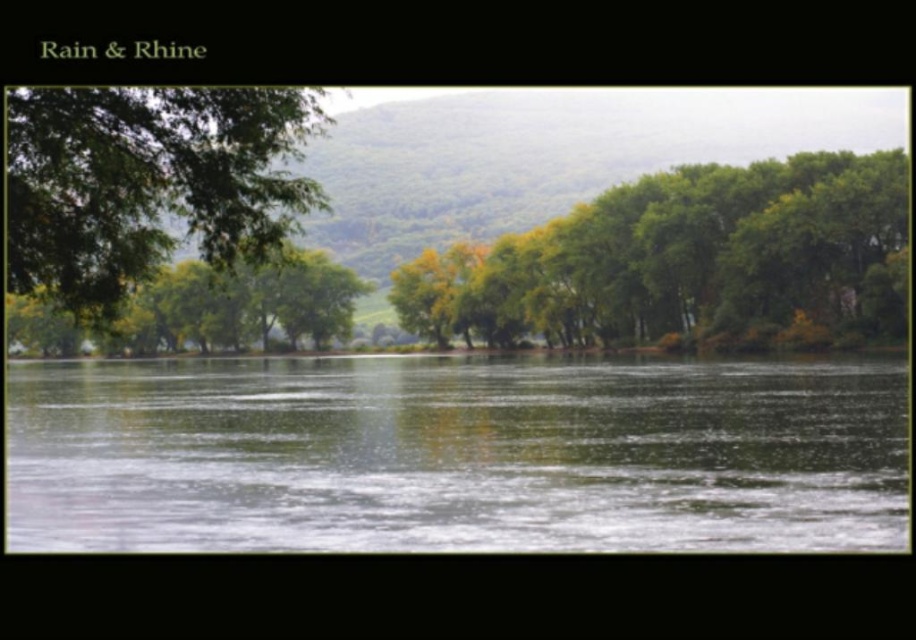
You are standing at the riverside and want to cross the river using a small wooden bridge. The bridge you have can only support objects up to the width of the green leafy tree at left. Will the bridge be wide enough to cross the green reflective water at center?

The green reflective water at center might be wider than green leafy tree at left, so the bridge may not be wide enough to cross the water safely.

You are standing on the riverside and see the green leafy trees at center and the green leafy tree at left. Which one is positioned more to the right side of the scene?

The green leafy trees at center is positioned more to the right side of the scene compared to the green leafy tree at left.

You are a hiker who wants to cross the river using a small boat. The boat can carry you and your gear but requires at least 2 meters of clearance between the green reflective water at center and the green leafy trees at center to avoid getting stuck. Is the distance sufficient?

The distance between the green reflective water at center and the green leafy trees at center is 27.46 meters, which is more than enough to provide the required 2 meters of clearance. Therefore, the boat can safely cross without getting stuck.